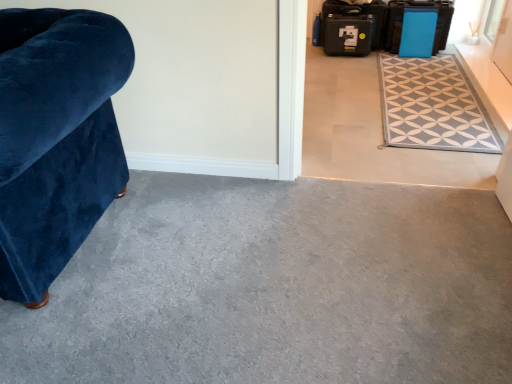
Question: From the image's perspective, is blue matte suitcase at upper right, placed as the second luggage when sorted from right to left, above or below gray carpet at lower left, which is counted as the 2th concrete, starting from the top?

Choices:
 (A) below
 (B) above

Answer: (B)

Question: Relative to gray carpet at lower left, the first concrete viewed from the front, is blue matte suitcase at upper right, placed as the second luggage when sorted from right to left, in front or behind?

Choices:
 (A) front
 (B) behind

Answer: (B)

Question: Which of these objects is positioned closest to the blue matte suitcase at upper right, placed as the second luggage when sorted from right to left?

Choices:
 (A) gray carpet at lower left, which appears as the 2th concrete when viewed from the back
 (B) black plastic suitcase at upper right, which is the 3th luggage from right to left
 (C) velvet blue armchair at left
 (D) blue plastic suitcase at upper right, positioned as the 1th luggage in right-to-left order
 (E) gray tile floor at center, the second concrete when ordered from bottom to top

Answer: (D)

Question: Based on their relative distances, which object is nearer to the black plastic suitcase at upper right, which is the 3th luggage from right to left?

Choices:
 (A) velvet blue armchair at left
 (B) gray tile floor at center, placed as the 1th concrete when sorted from top to bottom
 (C) gray carpet at lower left, the first concrete viewed from the front
 (D) gray fabric rug at upper right
 (E) blue matte suitcase at upper right, placed as the second luggage when sorted from right to left

Answer: (E)